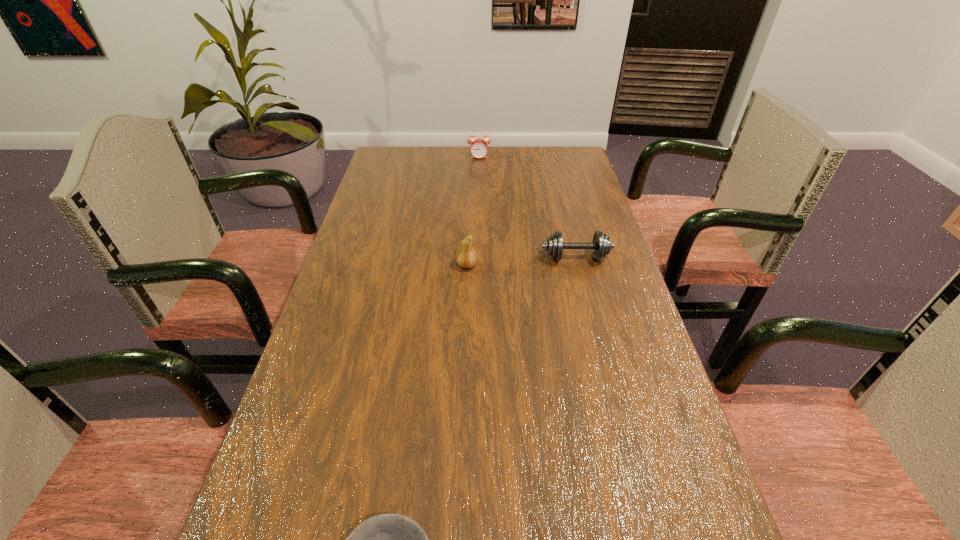
I want to click on free space that satisfies the following two spatial constraints: 1. on the clock face of the dumbbell; 2. on the right side of the farthest object, so click(479, 258).